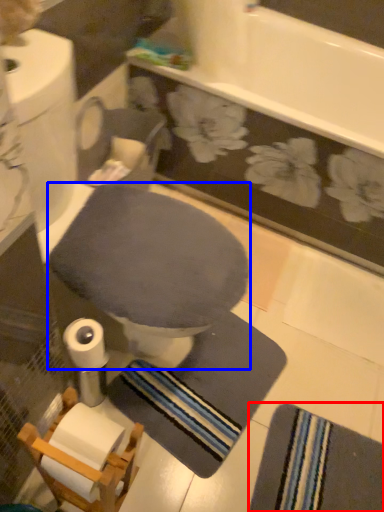
Question: Among these objects, which one is nearest to the camera, bath towel (highlighted by a red box) or toilet bowl (highlighted by a blue box)?

Choices:
 (A) bath towel
 (B) toilet bowl

Answer: (B)